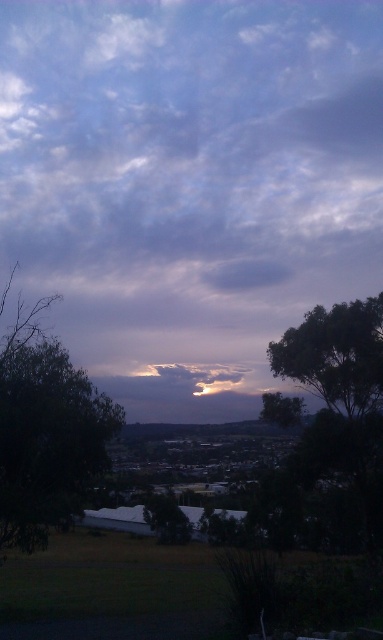
You are standing in the countryside and looking at the cloudy sky at center and the green leafy tree at right. Which object is closer to you?

The cloudy sky at center is closer to you because it is in front of the green leafy tree at right.

You are an architect designing a new home and want to ensure the living room has a view of both the cloudy sky at center and the green leafy tree at right. Based on their sizes in the image, which one would occupy more of the window space?

The cloudy sky at center occupies more of the window space because its width is larger than the green leafy tree at right.